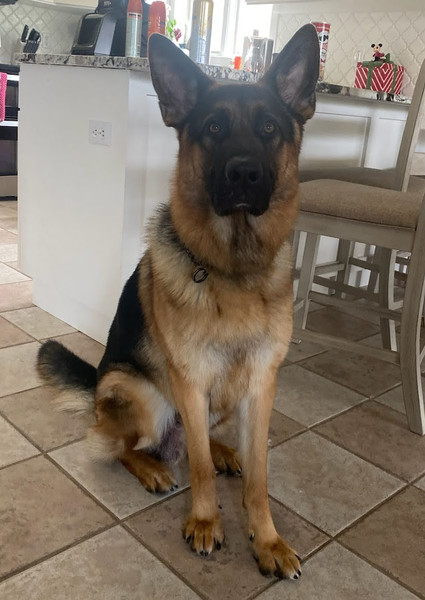
At what (x,y) coordinates should I click in order to perform the action: click on seats. Please return your answer as a coordinate pair (x, y). The width and height of the screenshot is (425, 600). Looking at the image, I should click on tap(363, 204), tap(362, 175).